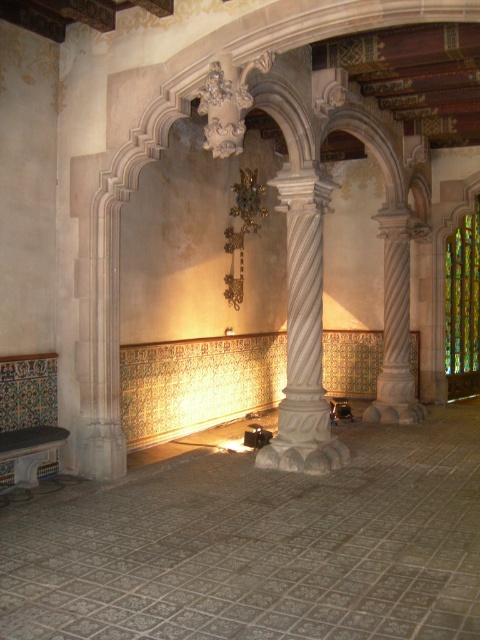
Question: Among these points, which one is nearest to the camera?

Choices:
 (A) (319, 456)
 (B) (447, 244)

Answer: (A)

Question: Which point appears farthest from the camera in this image?

Choices:
 (A) (475, 221)
 (B) (284, 164)

Answer: (A)

Question: Can you confirm if white marble column at center is thinner than multicolored stained glass at right?

Choices:
 (A) yes
 (B) no

Answer: (B)

Question: Is white marble column at center above multicolored stained glass at right?

Choices:
 (A) yes
 (B) no

Answer: (B)

Question: Does white marble column at center have a greater width compared to multicolored stained glass at right?

Choices:
 (A) yes
 (B) no

Answer: (A)